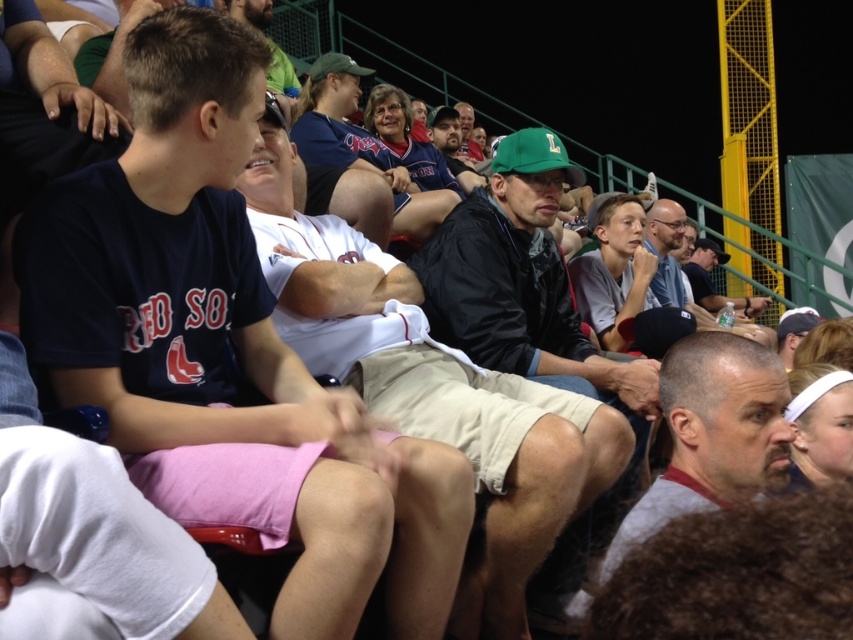
Does dark blue jersey at center have a lesser width compared to green fabric cap at center?

In fact, dark blue jersey at center might be wider than green fabric cap at center.

Is the position of dark blue jersey at center more distant than that of green fabric cap at center?

No, it is in front of green fabric cap at center.

Describe the element at coordinates (227, 346) in the screenshot. I see `dark blue jersey at center` at that location.

You are a GUI agent. You are given a task and a screenshot of the screen. Output one action in this format:
    pyautogui.click(x=<x>, y=<y>)
    Task: Click on the dark blue jersey at center
    
    Given the screenshot: What is the action you would take?
    pyautogui.click(x=227, y=346)

Which is in front, point (196, 353) or point (672, 372)?

Positioned in front is point (196, 353).

This screenshot has height=640, width=853. Describe the element at coordinates (227, 346) in the screenshot. I see `dark blue jersey at center` at that location.

Which is behind, point (456, 500) or point (759, 436)?

Point (759, 436)

You are a GUI agent. You are given a task and a screenshot of the screen. Output one action in this format:
    pyautogui.click(x=<x>, y=<y>)
    Task: Click on the dark blue jersey at center
    
    Given the screenshot: What is the action you would take?
    pyautogui.click(x=227, y=346)

Which is more to the right, dark blue jersey at center or khaki shorts at center?

khaki shorts at center is more to the right.

Identify the location of dark blue jersey at center. The image size is (853, 640). (227, 346).